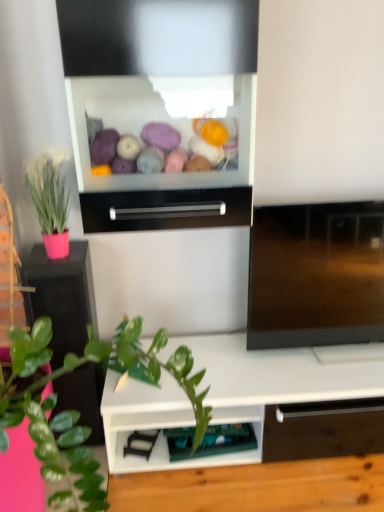
You are a GUI agent. You are given a task and a screenshot of the screen. Output one action in this format:
    pyautogui.click(x=<x>, y=<y>)
    Task: Click on the empty space that is ontop of black glossy drawer at center (from a real-world perspective)
    The height and width of the screenshot is (512, 384).
    Given the screenshot: What is the action you would take?
    pyautogui.click(x=172, y=183)